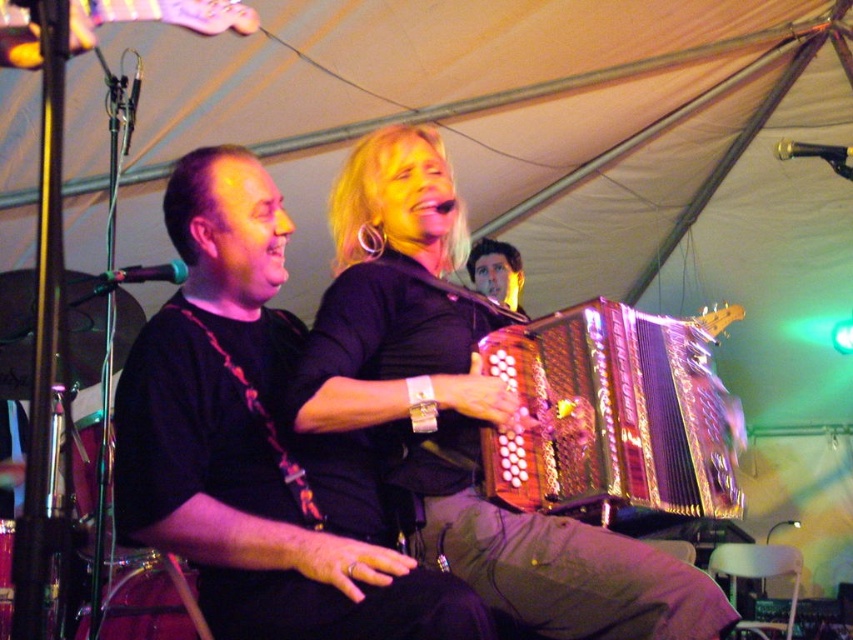
Is gold metallic accordion at center above metallic pink guitar at upper left?

No, gold metallic accordion at center is not above metallic pink guitar at upper left.

Is point (657, 449) behind point (245, 22)?

Yes.

Where is `gold metallic accordion at center`? gold metallic accordion at center is located at coordinates (611, 413).

Consider the image. Can you confirm if black fabric shirt at center is shorter than gold metallic accordion at center?

No, black fabric shirt at center is not shorter than gold metallic accordion at center.

Is black fabric shirt at center above gold metallic accordion at center?

No, black fabric shirt at center is not above gold metallic accordion at center.

Describe the element at coordinates (248, 440) in the screenshot. I see `black fabric shirt at center` at that location.

I want to click on black fabric shirt at center, so 248,440.

Who is shorter, metallic gold accordion at center or gold metallic accordion at center?

gold metallic accordion at center

Who is lower down, metallic gold accordion at center or gold metallic accordion at center?

metallic gold accordion at center

Is point (402, 433) more distant than point (550, 445)?

No, it is in front of (550, 445).

This screenshot has height=640, width=853. What are the coordinates of `metallic gold accordion at center` in the screenshot? It's located at (454, 419).